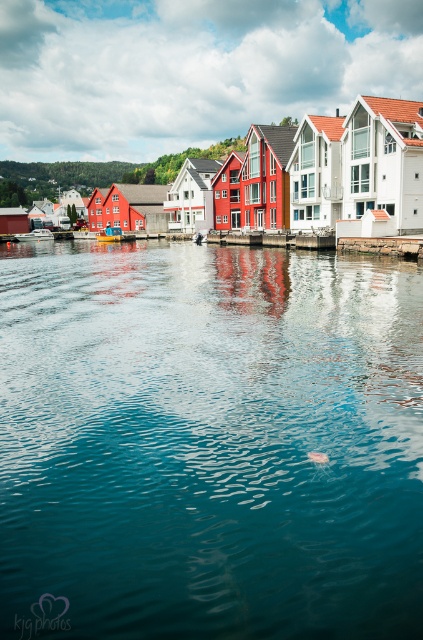
You are standing on the shore looking at the waterfront scene. There is blue water at center and a white glossy boat at center. Which one appears nearer to you?

The blue water at center is closer to the viewer than the white glossy boat at center, so the blue water at center appears nearer.

You are standing on the shore looking at the blue plastic boat at center and the blue water at center. Which object is closer to your right side?

The blue water at center is to the right of the blue plastic boat at center, so the blue water at center is closer to your right side.

Looking at this image, you are standing at the waterfront and see the red house and the point marked at coordinates (208, 444). Which direction should you face to look towards the red house from the marked point?

The point marked at coordinates (208, 444) is in the blue water at center. Since the red house is along the shore where the colorful houses are located, you should face towards the shore to look towards the red house from the marked point.